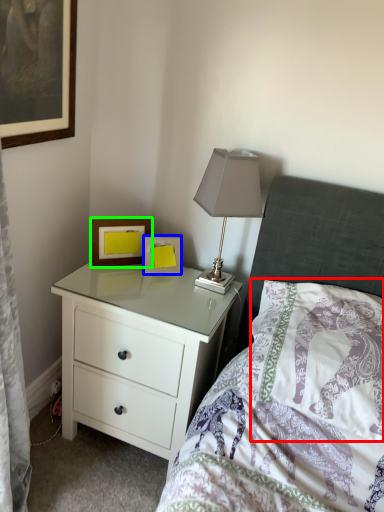
Question: Which is farther away from pillow (highlighted by a red box)? picture frame (highlighted by a blue box) or picture frame (highlighted by a green box)?

Choices:
 (A) picture frame
 (B) picture frame

Answer: (B)